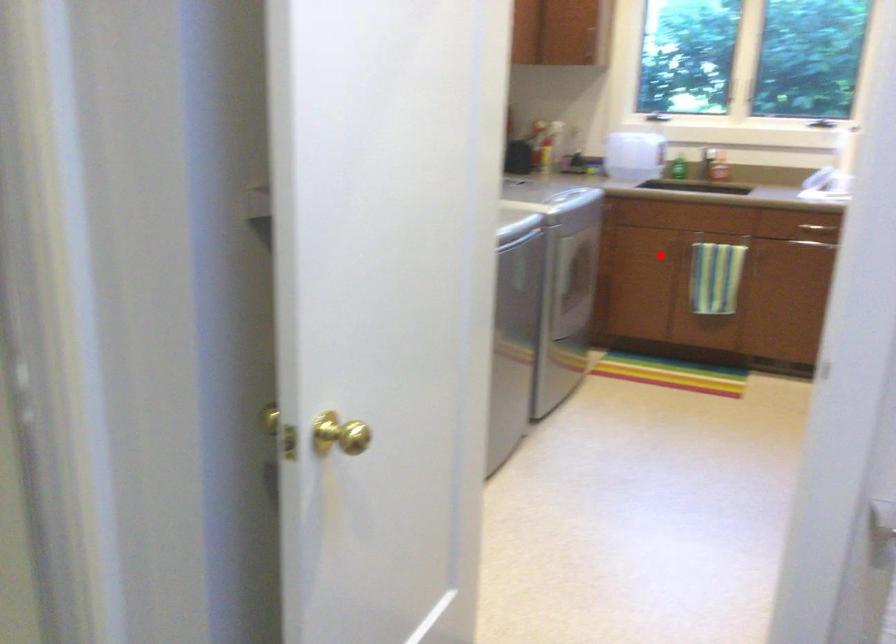
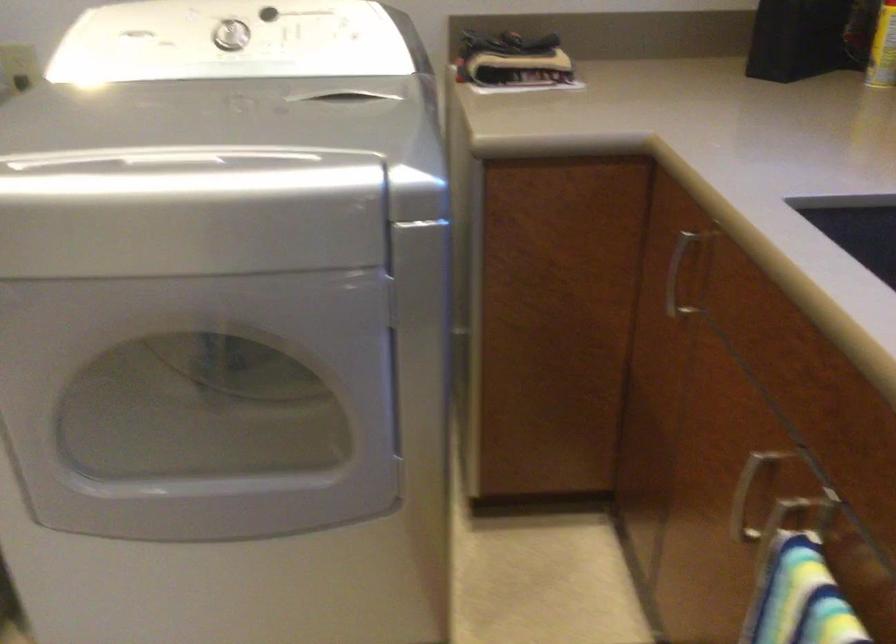
Question: I am providing you with two images of the same scene from different viewpoints. In image1, a red point is highlighted. Considering the same 3D point in image2, which of the following is correct?

Choices:
 (A) It is closer
 (B) It is farther

Answer: (A)